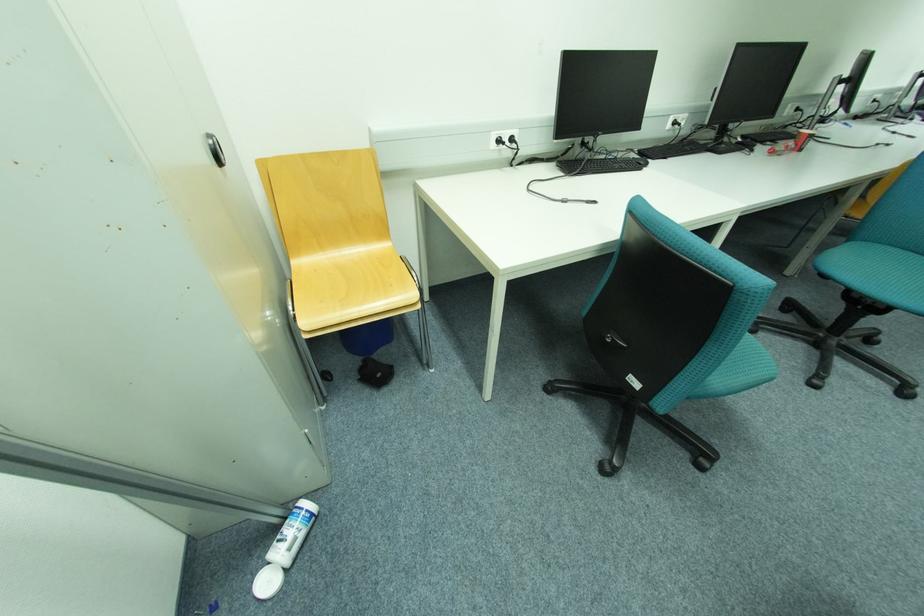
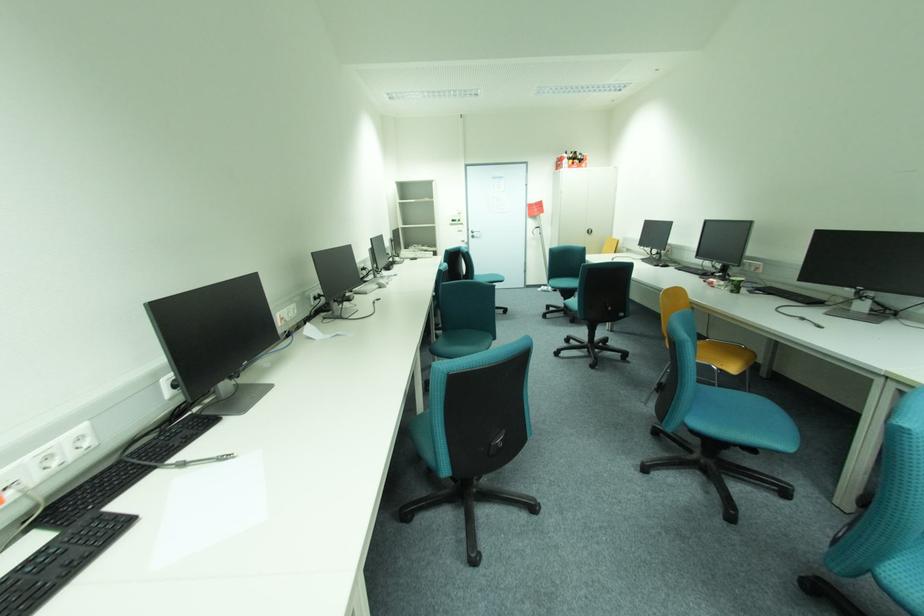
Find the pixel in the second image that matches pixel 807 150 in the first image.

(738, 292)